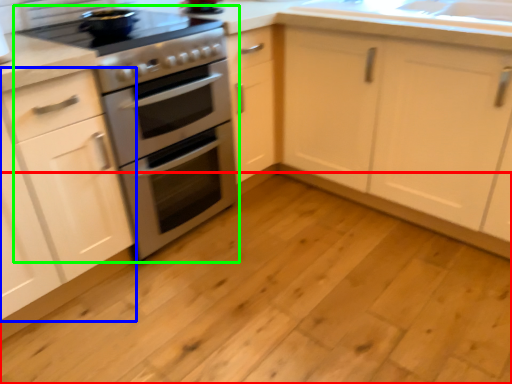
Question: Estimate the real-world distances between objects in this image. Which object is closer to plain (highlighted by a red box), cabinetry (highlighted by a blue box) or appliance (highlighted by a green box)?

Choices:
 (A) cabinetry
 (B) appliance

Answer: (B)